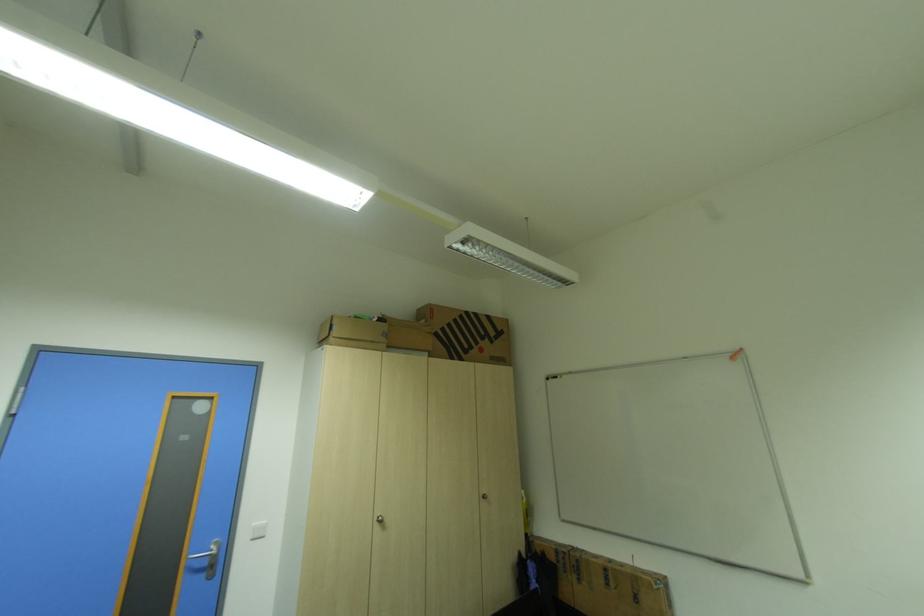
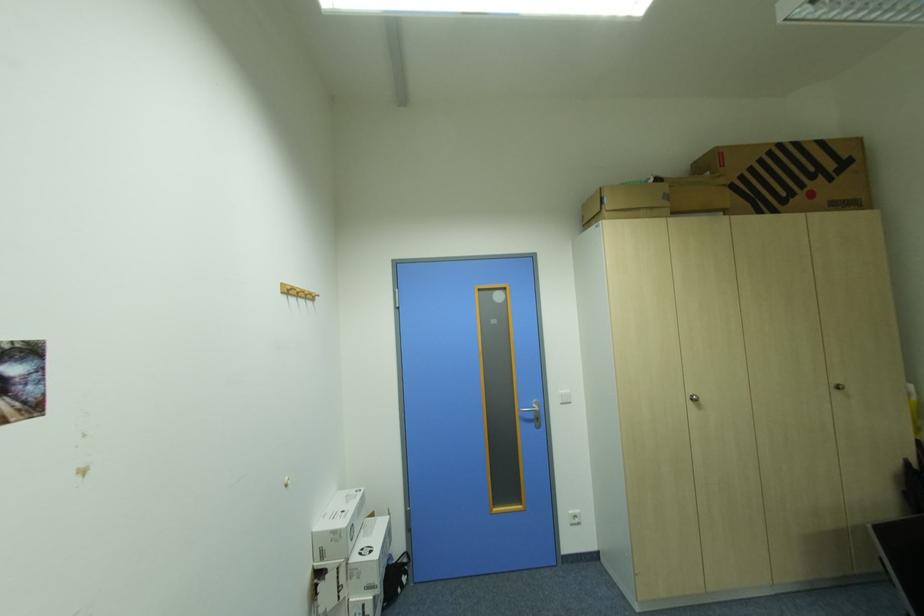
Find the pixel in the second image that matches point (489, 496) in the first image.

(840, 386)